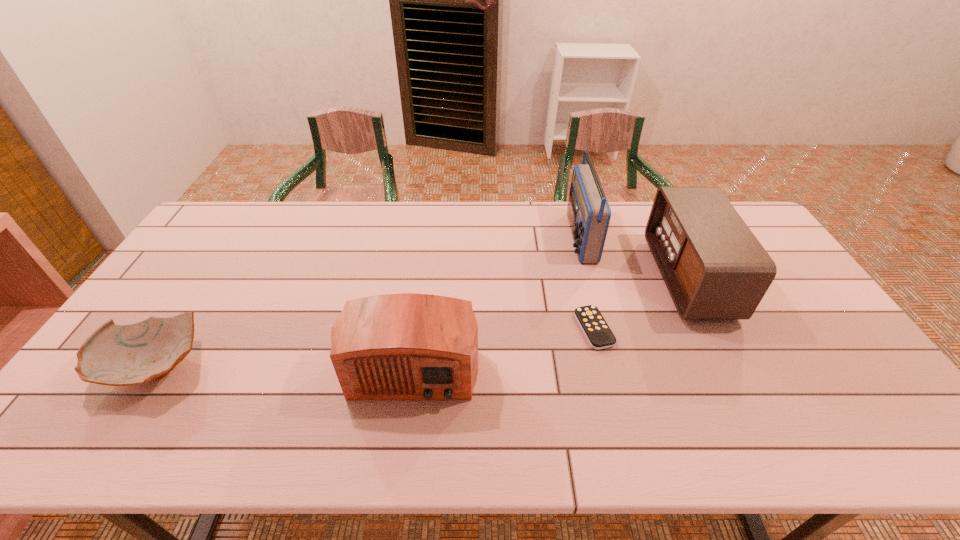
You are a GUI agent. You are given a task and a screenshot of the screen. Output one action in this format:
    pyautogui.click(x=<x>, y=<y>)
    Task: Click on the vacant space located 0.200m on the front-facing side of the rightmost radio receiver
    Image resolution: width=960 pixels, height=540 pixels.
    Given the screenshot: What is the action you would take?
    pyautogui.click(x=595, y=278)

At what (x,y) coordinates should I click in order to perform the action: click on vacant space situated 0.150m on the front-facing side of the rightmost radio receiver. Please return your answer as a coordinate pair (x, y). Image resolution: width=960 pixels, height=540 pixels. Looking at the image, I should click on (612, 278).

The width and height of the screenshot is (960, 540). I want to click on vacant space located 0.100m on the front-facing side of the second object from left to right, so 402,450.

Image resolution: width=960 pixels, height=540 pixels. Identify the location of free space located 0.160m on the right of the leftmost object. (271, 367).

You are a GUI agent. You are given a task and a screenshot of the screen. Output one action in this format:
    pyautogui.click(x=<x>, y=<y>)
    Task: Click on the vacant area situated 0.100m on the left of the shortest object
    The height and width of the screenshot is (540, 960).
    Given the screenshot: What is the action you would take?
    pyautogui.click(x=540, y=329)

This screenshot has width=960, height=540. Find the location of `object positioned at the left edge`. object positioned at the left edge is located at coordinates (115, 355).

In the image, there is a desktop. Identify the location of free space at the far edge. (443, 213).

Image resolution: width=960 pixels, height=540 pixels. Identify the location of vacant space at the near edge. (739, 437).

In the image, there is a desktop. Where is `vacant space at the left edge`? vacant space at the left edge is located at coordinates (168, 298).

In the image, there is a desktop. Where is `free space at the right edge`? This screenshot has height=540, width=960. free space at the right edge is located at coordinates (762, 311).